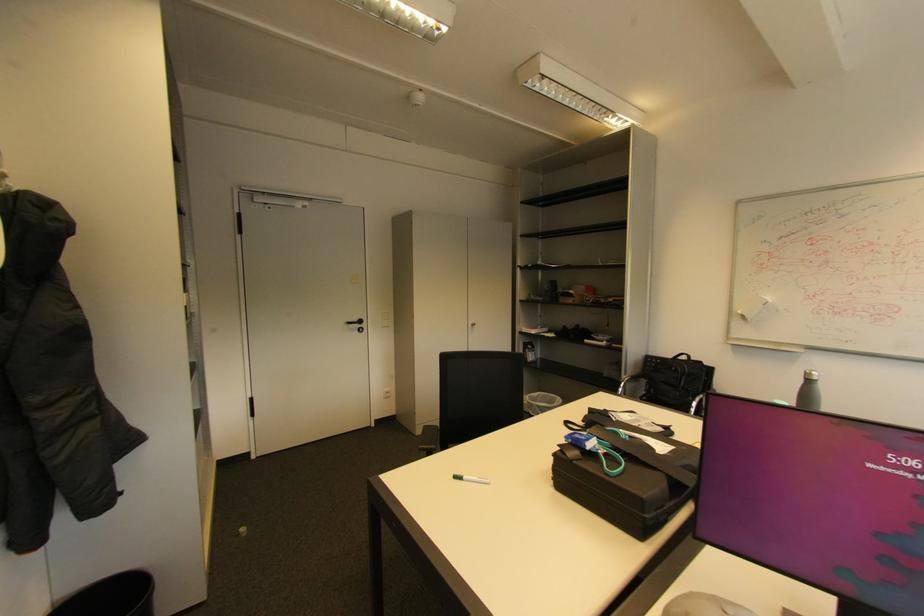
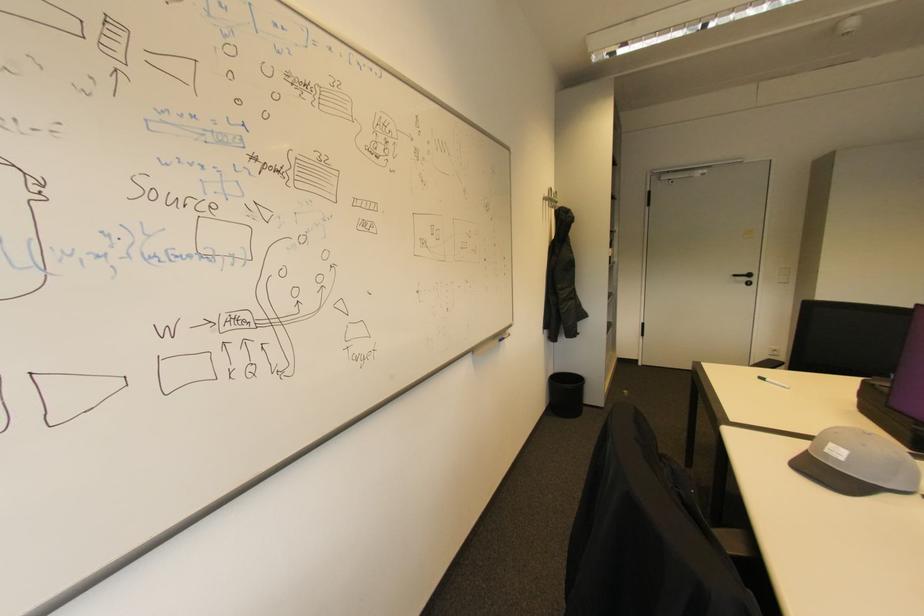
Locate, in the second image, the point that corresponds to (460,477) in the first image.

(768, 379)